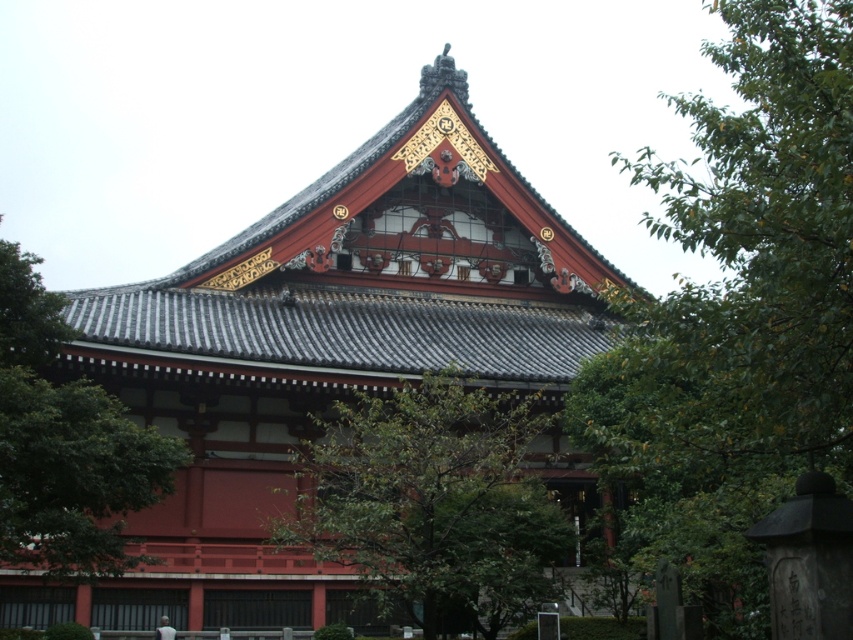
Question: Can you confirm if green leafy tree at center is smaller than green leafy tree at upper left?

Choices:
 (A) yes
 (B) no

Answer: (B)

Question: Which point appears closest to the camera in this image?

Choices:
 (A) (705, 436)
 (B) (383, 538)

Answer: (A)

Question: Among these points, which one is nearest to the camera?

Choices:
 (A) (491, 426)
 (B) (3, 374)
 (C) (833, 189)

Answer: (C)

Question: Does green leafy tree at upper right have a smaller size compared to green leafy tree at center?

Choices:
 (A) no
 (B) yes

Answer: (A)

Question: Considering the relative positions of green leafy tree at upper right and green leafy tree at upper left in the image provided, where is green leafy tree at upper right located with respect to green leafy tree at upper left?

Choices:
 (A) below
 (B) above

Answer: (B)

Question: Which point is farther from the camera taking this photo?

Choices:
 (A) (369, 460)
 (B) (733, 497)
 (C) (122, 456)

Answer: (A)